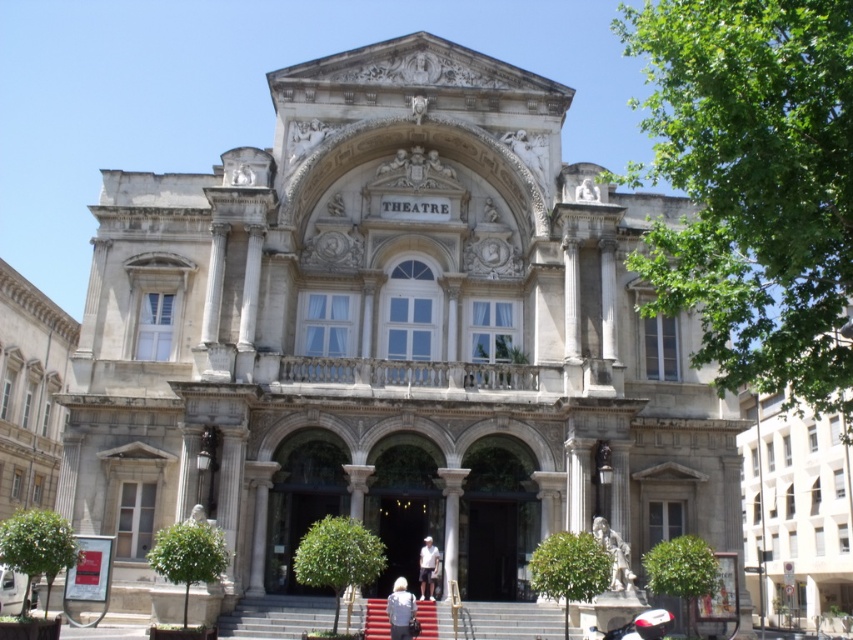
Question: Estimate the real-world distances between objects in this image. Which object is closer to the red carpet at center?

Choices:
 (A) light gray fabric jacket at center
 (B) red carpeted stairs at center
 (C) white cotton shirt at center
 (D) black glass door at center

Answer: (A)

Question: Is red carpeted stairs at center below red carpet at center?

Choices:
 (A) yes
 (B) no

Answer: (A)

Question: Can you confirm if light gray fabric jacket at center is positioned to the left of white cotton shirt at center?

Choices:
 (A) yes
 (B) no

Answer: (A)

Question: Can you confirm if light gray fabric jacket at center is positioned above white cotton shirt at center?

Choices:
 (A) no
 (B) yes

Answer: (A)

Question: Considering the real-world distances, which object is closest to the black glass door at center?

Choices:
 (A) white marble statue at lower right
 (B) red carpet at center
 (C) white cotton shirt at center

Answer: (C)

Question: Which object is farther from the camera taking this photo?

Choices:
 (A) red carpeted stairs at center
 (B) white marble statue at lower right
 (C) light gray fabric jacket at center
 (D) wooden door at center

Answer: (D)